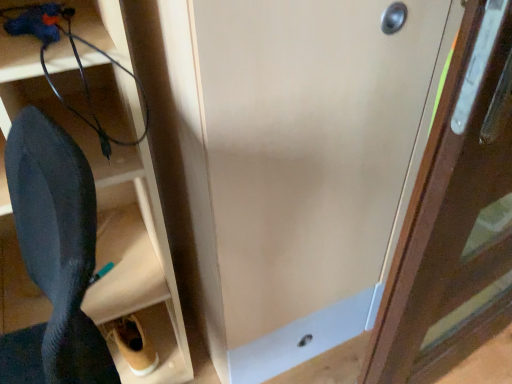
Question: Is black matte shoe at lower left positioned beyond the bounds of matte wood door at center, which ranks as the first door in left-to-right order?

Choices:
 (A) no
 (B) yes

Answer: (B)

Question: Can you confirm if black matte shoe at lower left is taller than matte wood door at center, the second door viewed from the right?

Choices:
 (A) yes
 (B) no

Answer: (B)

Question: Is black matte shoe at lower left wider than matte wood door at center, the second door viewed from the right?

Choices:
 (A) yes
 (B) no

Answer: (B)

Question: Could you tell me if black matte shoe at lower left is facing matte wood door at center, the second door viewed from the right?

Choices:
 (A) no
 (B) yes

Answer: (A)

Question: Considering the relative sizes of black matte shoe at lower left and matte wood door at center, which ranks as the first door in left-to-right order, in the image provided, is black matte shoe at lower left shorter than matte wood door at center, which ranks as the first door in left-to-right order,?

Choices:
 (A) yes
 (B) no

Answer: (A)

Question: From the image's perspective, does black matte shoe at lower left appear lower than matte wood door at center, which ranks as the first door in left-to-right order?

Choices:
 (A) yes
 (B) no

Answer: (A)

Question: Is wooden door at right, which ranks as the 1th door in right-to-left order, not within black rubber wire at lower left?

Choices:
 (A) yes
 (B) no

Answer: (A)

Question: Can black rubber wire at lower left be found inside wooden door at right, the 2th door when ordered from left to right?

Choices:
 (A) no
 (B) yes

Answer: (A)

Question: Does wooden door at right, the 2th door when ordered from left to right, lie in front of black rubber wire at lower left?

Choices:
 (A) yes
 (B) no

Answer: (A)

Question: Is wooden door at right, which ranks as the 1th door in right-to-left order, at the right side of black rubber wire at lower left?

Choices:
 (A) yes
 (B) no

Answer: (A)

Question: Is wooden door at right, which ranks as the 1th door in right-to-left order, shorter than black rubber wire at lower left?

Choices:
 (A) no
 (B) yes

Answer: (A)

Question: Can you confirm if wooden door at right, which ranks as the 1th door in right-to-left order, is smaller than black rubber wire at lower left?

Choices:
 (A) no
 (B) yes

Answer: (A)

Question: Does black matte shoe at lower left come behind black rubber wire at lower left?

Choices:
 (A) no
 (B) yes

Answer: (A)